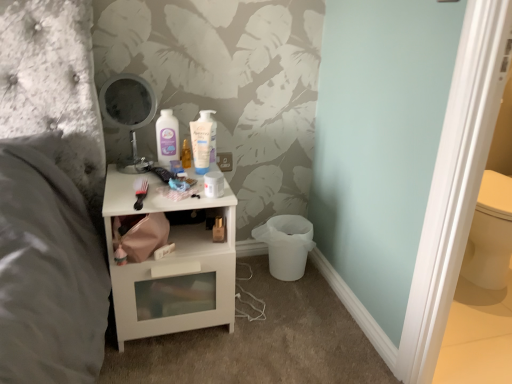
Locate an element on the screen. This screenshot has height=384, width=512. free point in front of matte plastic mouthwash at center, the 1th mouthwash from the left is located at coordinates (157, 180).